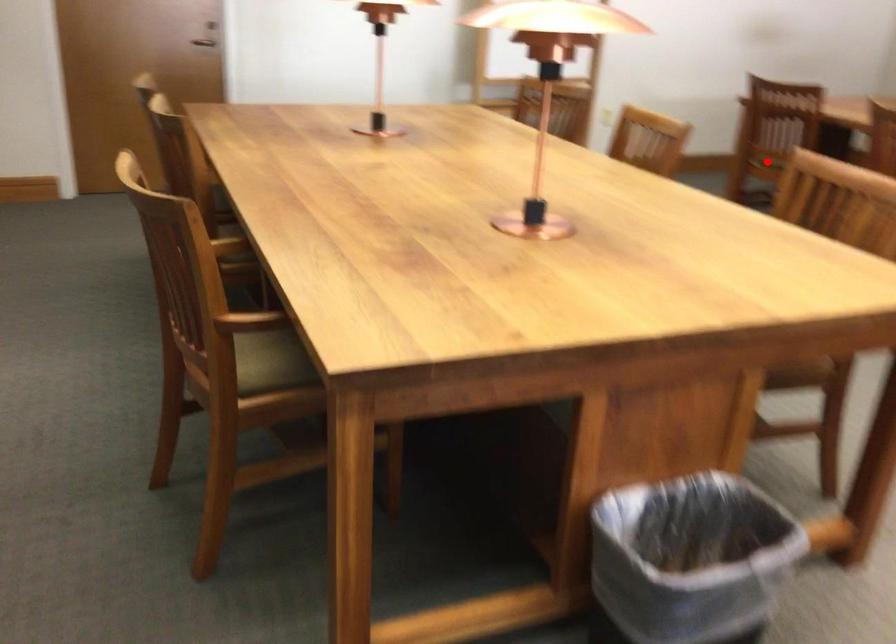
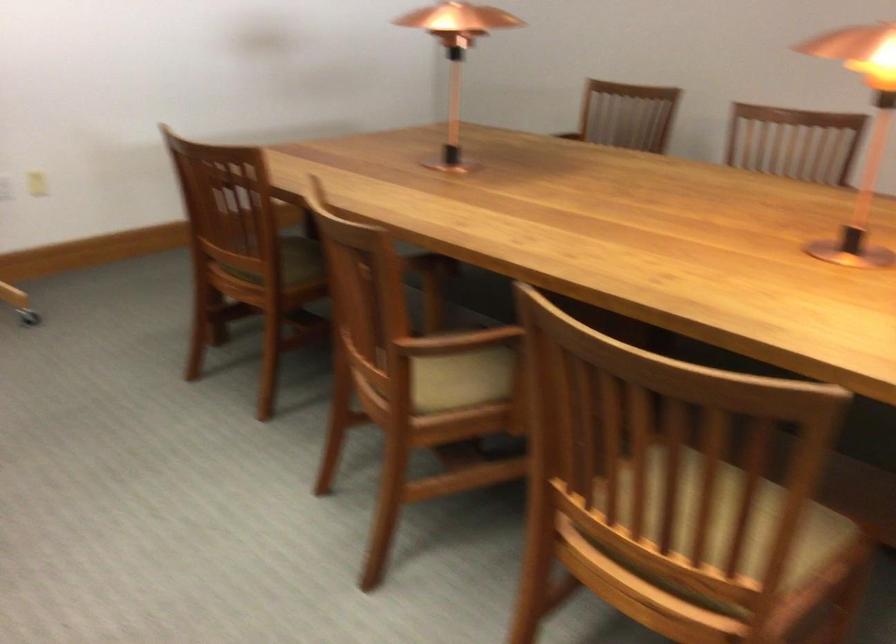
Question: I am providing you with two images of the same scene from different viewpoints. A red point is marked on the first image. Can you still see the location of the red point in image 2?

Choices:
 (A) Yes
 (B) No

Answer: (B)